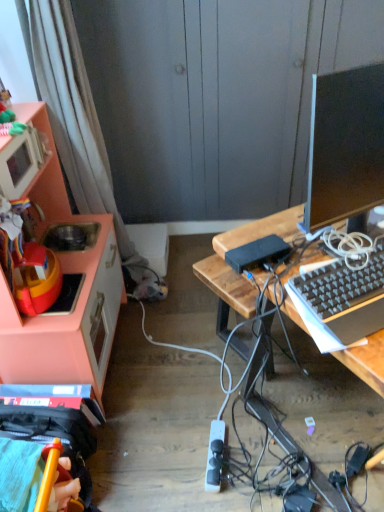
Question: From the image's perspective, is pink matte cabinet at left above or below wooden desk at center?

Choices:
 (A) above
 (B) below

Answer: (A)

Question: Relative to wooden desk at center, is pink matte cabinet at left in front or behind?

Choices:
 (A) front
 (B) behind

Answer: (B)

Question: Estimate the real-world distances between objects in this image. Which object is closer to the white fabric curtain at left?

Choices:
 (A) white plastic power outlet at lower center
 (B) black matte power bank at center
 (C) black glossy monitor at right
 (D) wooden desk at center
 (E) pink matte cabinet at left

Answer: (E)

Question: Estimate the real-world distances between objects in this image. Which object is farther from the black plastic keyboard at right?

Choices:
 (A) wooden desk at center
 (B) white plastic power outlet at lower center
 (C) black glossy monitor at right
 (D) black matte power bank at center
 (E) pink matte cabinet at left

Answer: (E)